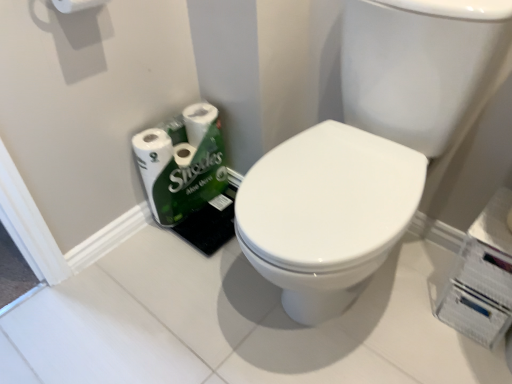
Question: From a real-world perspective, is white matte toilet paper at upper left, positioned as the 1th toilet paper in top-to-bottom order, above or below white glossy sink at center?

Choices:
 (A) below
 (B) above

Answer: (B)

Question: Is white matte toilet paper at upper left, positioned as the 1th toilet paper in top-to-bottom order, situated inside white glossy sink at center or outside?

Choices:
 (A) outside
 (B) inside

Answer: (A)

Question: Which is farther from the white glossy sink at center?

Choices:
 (A) white matte toilet paper at upper left, marked as the first toilet paper in a front-to-back arrangement
 (B) white glossy toilet paper at lower left, arranged as the first toilet paper when ordered from the bottom

Answer: (A)

Question: Which object is the farthest from the white matte toilet paper at upper left, which ranks as the 2th toilet paper in back-to-front order?

Choices:
 (A) white glossy sink at center
 (B) white glossy toilet paper at lower left, arranged as the first toilet paper when ordered from the bottom

Answer: (A)